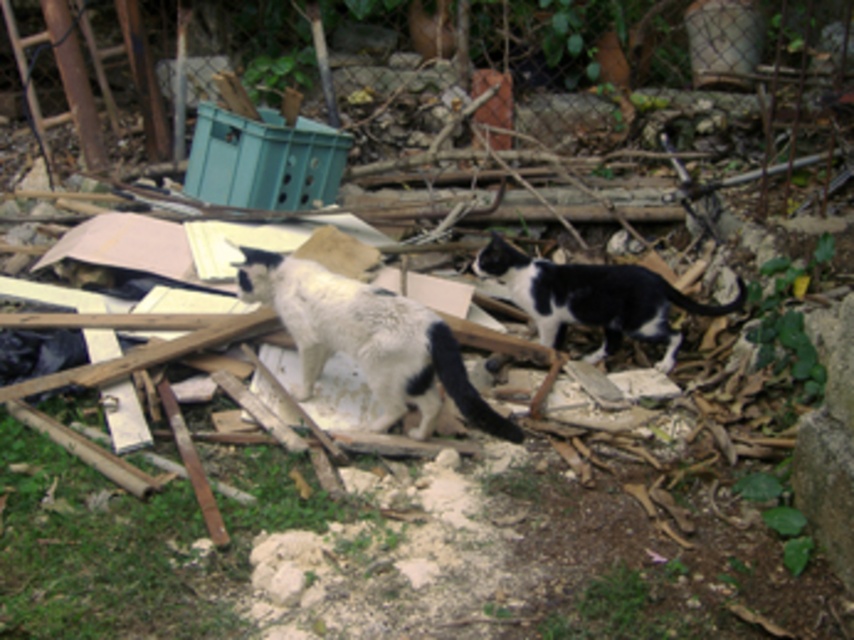
Is white fur cat at center further to the viewer compared to black and white fur cat at center?

No.

Is white fur cat at center in front of black and white fur cat at center?

Yes.

Which is behind, point (455, 355) or point (664, 321)?

Point (664, 321)

Where is `white fur cat at center`? This screenshot has width=854, height=640. white fur cat at center is located at coordinates (367, 339).